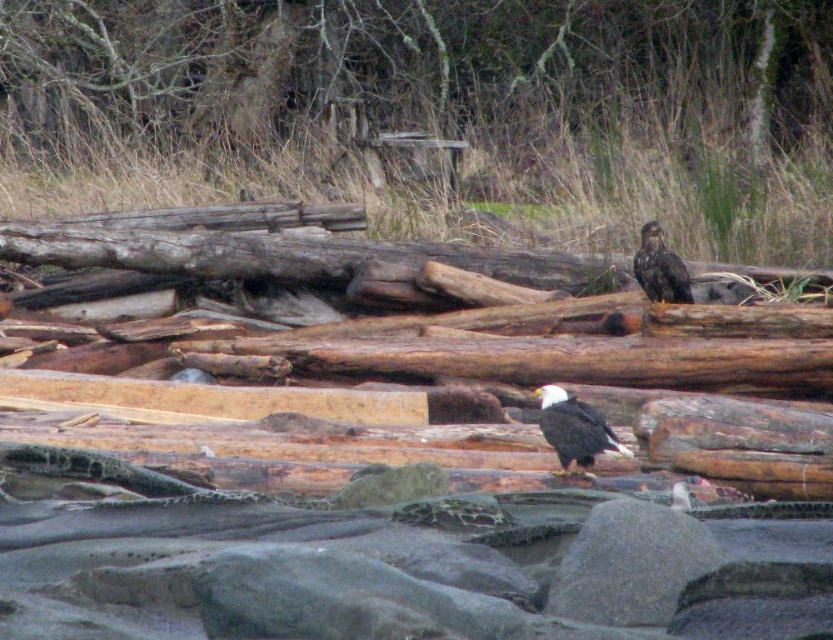
You are a birdwatcher observing two features in the scene. You see the brown rough wood at upper center and the dark brown feathers at upper right. Which of these is positioned more to the right side of the image?

The dark brown feathers at upper right are positioned more to the right side of the image than the brown rough wood at upper center.

You are a birdwatcher standing at the shoreline looking at the scene. You notice a point labeled as point (574, 429). What does this point represent?

The point (574, 429) represents the location of the white feathered bald eagle at center.